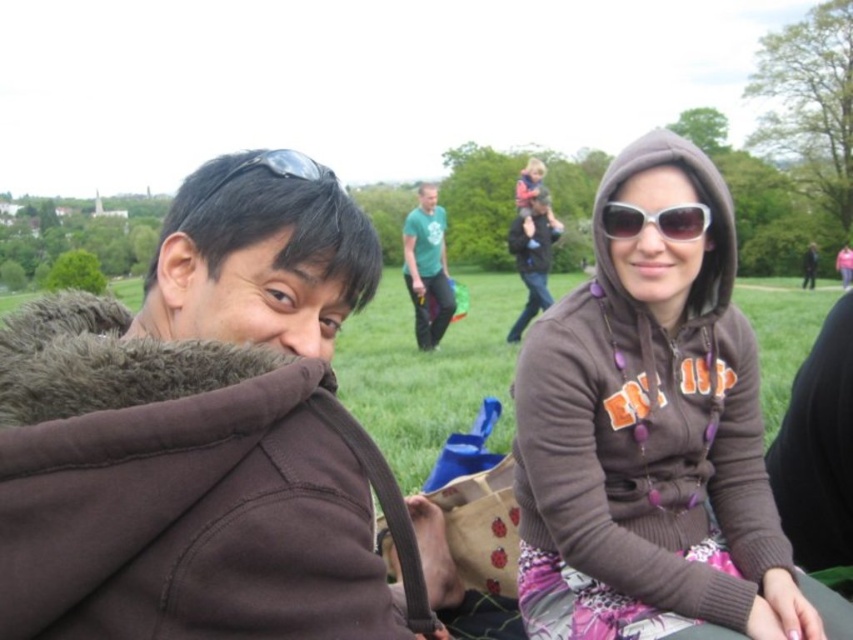
Measure the distance from brown hoodie at center to matte pink hoodie at upper center.

They are 11.14 meters apart.

Which of these two, brown hoodie at center or matte pink hoodie at upper center, stands shorter?

Standing shorter between the two is brown hoodie at center.

Who is more distant from viewer, (631, 257) or (524, 224)?

The point (524, 224) is behind.

Where is `brown hoodie at center`? brown hoodie at center is located at coordinates (650, 433).

Can you confirm if brown hoodie at center is positioned below sunglasses at center?

Indeed, brown hoodie at center is positioned under sunglasses at center.

Which of these two, brown hoodie at center or sunglasses at center, stands shorter?

Standing shorter between the two is sunglasses at center.

I want to click on brown hoodie at center, so pyautogui.click(x=650, y=433).

The height and width of the screenshot is (640, 853). Describe the element at coordinates (427, 268) in the screenshot. I see `green fabric shirt at center` at that location.

Who is more forward, (442, 211) or (525, 179)?

Positioned in front is point (442, 211).

Who is more forward, (440,284) or (515,189)?

Point (440,284) is more forward.

I want to click on green fabric shirt at center, so coord(427,268).